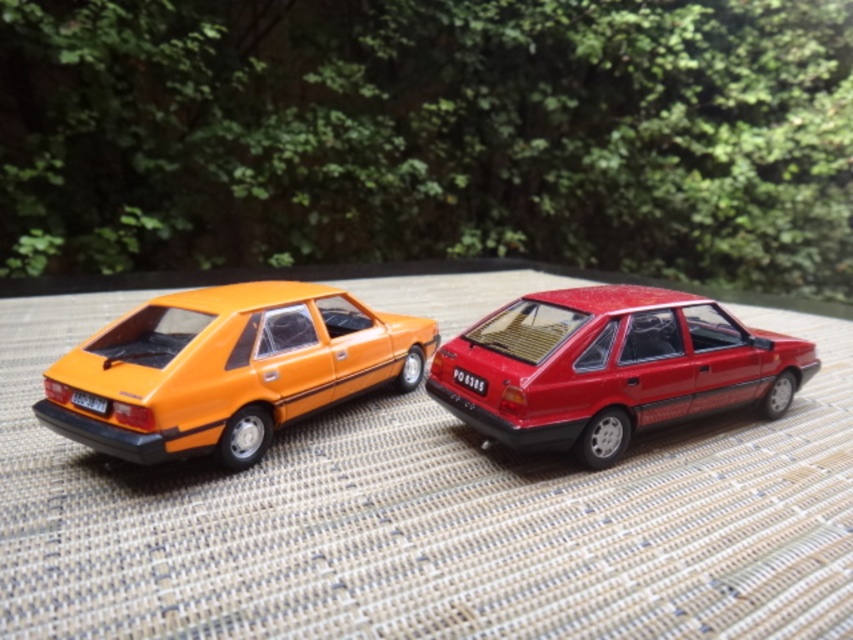
Question: Based on their relative distances, which object is farther from the glossy red car at center?

Choices:
 (A) white plastic license plate at lower left
 (B) orange matte car at left

Answer: (A)

Question: Which point is closer to the camera?

Choices:
 (A) glossy red car at center
 (B) white plastic license plate at lower left

Answer: (B)

Question: In this image, where is orange matte car at left located relative to glossy red car at center?

Choices:
 (A) below
 (B) above

Answer: (B)

Question: Which of the following is the farthest from the observer?

Choices:
 (A) (463, 385)
 (B) (82, 396)
 (C) (498, 317)
 (D) (335, 336)

Answer: (D)

Question: Can you confirm if glossy red car at center is wider than white plastic license plate at lower left?

Choices:
 (A) yes
 (B) no

Answer: (A)

Question: Where is white plastic license plate at lower left located in relation to red plastic license plate at center in the image?

Choices:
 (A) below
 (B) above

Answer: (A)